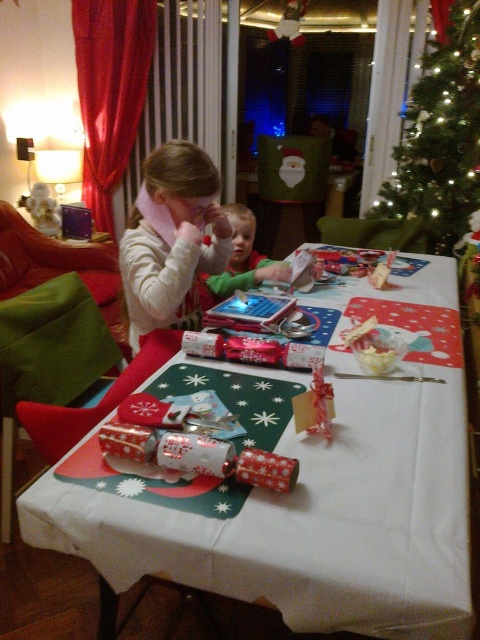
You are a guest at the Christmas party and want to place your gift under the green textured christmas tree at upper right. However, you notice the white paper table at center is in the way. Can you place your gift directly under the tree without moving the table?

The white paper table at center is below the green textured christmas tree at upper right, so the table is positioned directly under the tree. This means you cannot place your gift directly under the tree without moving the table.

You are a guest at this Christmas party and want to take a photo of the green textured christmas tree at upper right and the matte white sweater at upper left. Which object should you focus on first if you want to capture both in one frame without moving the camera?

The green textured christmas tree at upper right is above the matte white sweater at upper left, so you should focus on the green textured christmas tree at upper right first to ensure both are in the frame.

You are at a Christmas party and see the matte white sweater at upper left and the green matte shirt at center. Which one is positioned more to the left side of the table?

The matte white sweater at upper left is positioned more to the left side of the table than the green matte shirt at center.